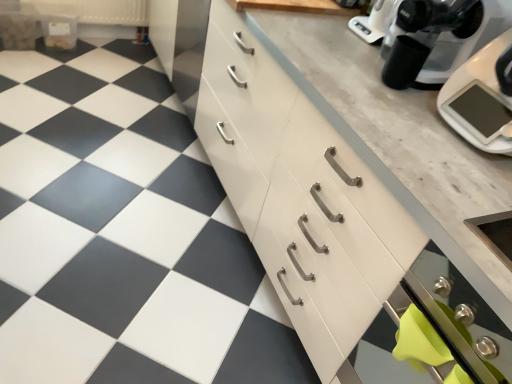
The height and width of the screenshot is (384, 512). What are the coordinates of `free space to the left of white glossy kitchen scale at upper right` in the screenshot? It's located at (393, 111).